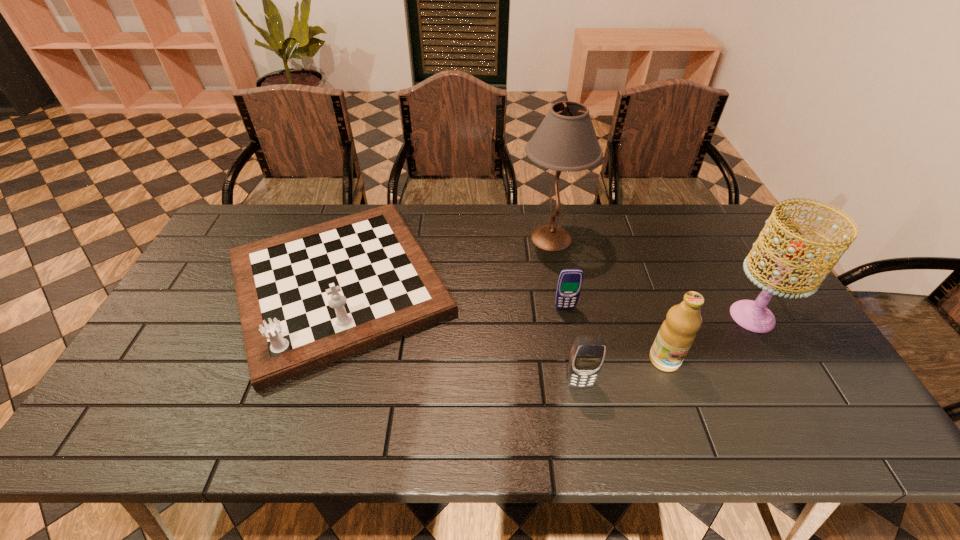
The height and width of the screenshot is (540, 960). Identify the location of table lamp. (566, 140).

This screenshot has width=960, height=540. I want to click on the fifth shortest object, so click(x=754, y=316).

Where is `lampshade`? The width and height of the screenshot is (960, 540). lampshade is located at coordinates (754, 316).

This screenshot has height=540, width=960. I want to click on the fourth shortest object, so click(677, 333).

At what (x,y) coordinates should I click in order to perform the action: click on the second object from right to left. Please return your answer as a coordinate pair (x, y). Image resolution: width=960 pixels, height=540 pixels. Looking at the image, I should click on (677, 333).

At what (x,y) coordinates should I click in order to perform the action: click on gameboard. Please return your answer as a coordinate pair (x, y). This screenshot has height=540, width=960. Looking at the image, I should click on (308, 298).

Locate an element on the screen. The width and height of the screenshot is (960, 540). the taller cellular telephone is located at coordinates (587, 355).

Locate an element on the screen. the farther cellular telephone is located at coordinates coord(569,285).

Find the location of a particular element. the shortest object is located at coordinates (569, 285).

At what (x,y) coordinates should I click in order to perform the action: click on blank area located on the front-facing side of the table lamp. Please return your answer as a coordinate pair (x, y). This screenshot has height=540, width=960. Looking at the image, I should click on (468, 238).